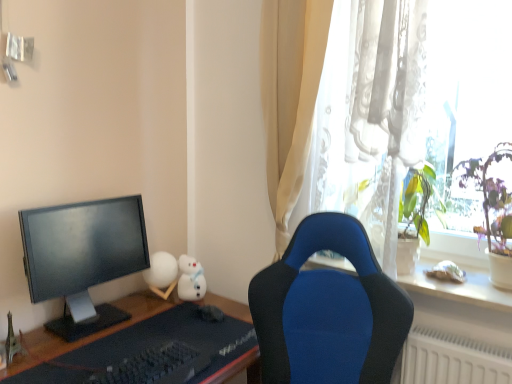
Question: Relative to black matte keyboard at lower center, is white matte sphere at center-left, the second toy when ordered from left to right, in front or behind?

Choices:
 (A) behind
 (B) front

Answer: (A)

Question: Considering the positions of white matte sphere at center-left, placed as the 3th toy when sorted from right to left, and black matte keyboard at lower center in the image, is white matte sphere at center-left, placed as the 3th toy when sorted from right to left, wider or thinner than black matte keyboard at lower center?

Choices:
 (A) thin
 (B) wide

Answer: (A)

Question: Which of these objects is positioned closest to the matte black monitor at left?

Choices:
 (A) white matte plush toy at center, which ranks as the 3th toy in front-to-back order
 (B) white plush toy at upper right, the third toy viewed from the back
 (C) green leafy plant at right
 (D) black matte desk at lower left
 (E) metallic silver eiffel tower at lower left, placed as the 4th toy when sorted from right to left

Answer: (D)

Question: Which is nearer to the black matte desk at lower left?

Choices:
 (A) matte black monitor at left
 (B) black matte keyboard at lower center
 (C) white plush toy at upper right, the second toy in the front-to-back sequence
 (D) white matte sphere at center-left, which is the first toy from back to front
 (E) green leafy plant at right

Answer: (B)